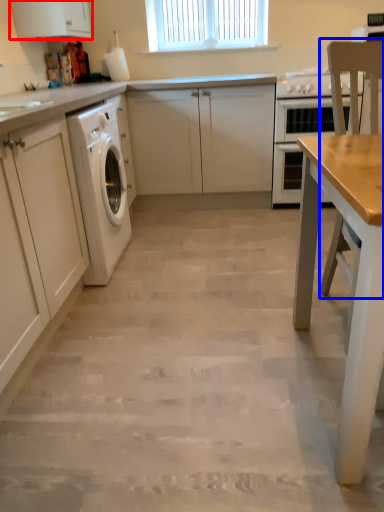
Question: Which point is further to the camera, cabinetry (highlighted by a red box) or chair (highlighted by a blue box)?

Choices:
 (A) cabinetry
 (B) chair

Answer: (A)